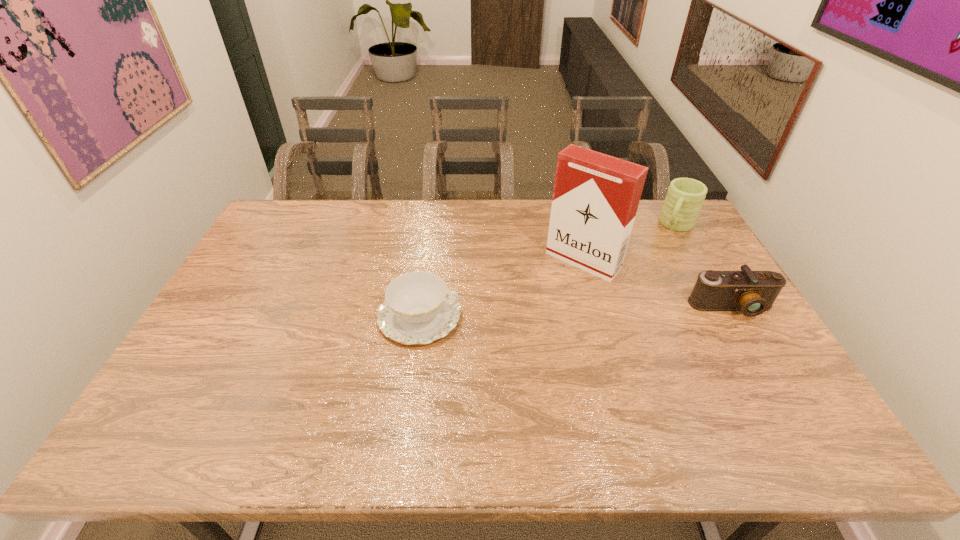
This screenshot has width=960, height=540. What are the coordinates of `vacant space located on the side of the farthest object with the handle` in the screenshot? It's located at (647, 277).

Find the location of a particular element. blank space located on the side of the farthest object with the handle is located at coordinates (663, 251).

Find the location of a particular element. Image resolution: width=960 pixels, height=540 pixels. vacant space located 0.120m on the front-facing side of the cigarette_case is located at coordinates (544, 299).

Where is `free space located on the front-facing side of the cigarette_case`? free space located on the front-facing side of the cigarette_case is located at coordinates (542, 301).

You are a GUI agent. You are given a task and a screenshot of the screen. Output one action in this format:
    pyautogui.click(x=<x>, y=<y>)
    Task: Click on the vacant space located 0.370m on the front-facing side of the cigarette_case
    The height and width of the screenshot is (540, 960).
    Given the screenshot: What is the action you would take?
    pyautogui.click(x=494, y=352)

You are a GUI agent. You are given a task and a screenshot of the screen. Output one action in this format:
    pyautogui.click(x=<x>, y=<y>)
    Task: Click on the object that is at the far edge
    This screenshot has width=960, height=540.
    Given the screenshot: What is the action you would take?
    pyautogui.click(x=685, y=196)

Find the location of a particular element. camera that is at the right edge is located at coordinates (752, 292).

You are a GUI agent. You are given a task and a screenshot of the screen. Output one action in this format:
    pyautogui.click(x=<x>, y=<y>)
    Task: Click on the mug at the right edge
    Image resolution: width=960 pixels, height=540 pixels.
    Given the screenshot: What is the action you would take?
    pyautogui.click(x=685, y=196)

I want to click on object that is at the far right corner, so click(685, 196).

I want to click on vacant space at the far edge, so click(543, 199).